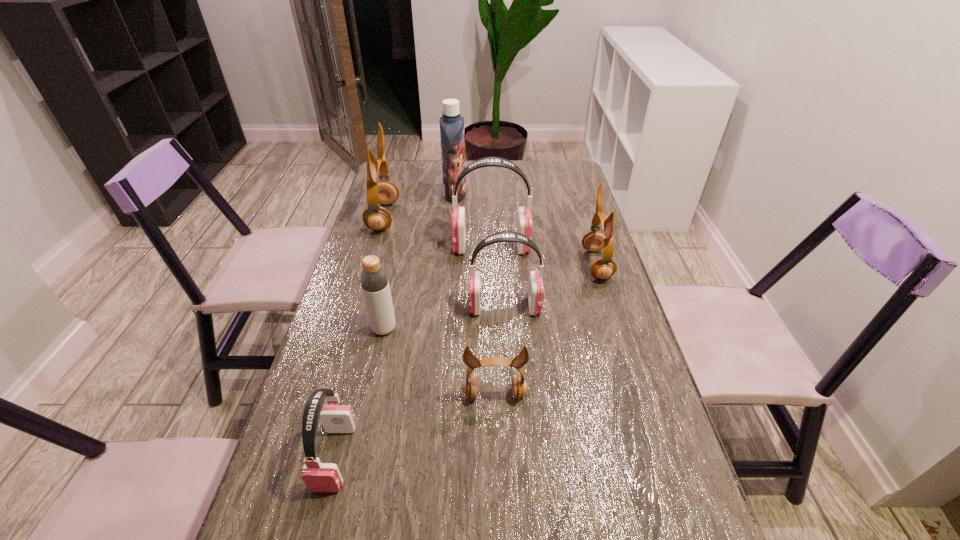
Where is `vacant space at the far edge`? The image size is (960, 540). vacant space at the far edge is located at coordinates (441, 178).

Identify the location of vacant area at the left edge. (351, 349).

In the image, there is a desktop. At what (x,y) coordinates should I click in order to perform the action: click on blank space at the right edge. Please return your answer as a coordinate pair (x, y). This screenshot has width=960, height=540. Looking at the image, I should click on (598, 379).

The width and height of the screenshot is (960, 540). In order to click on free region at the far right corner of the desktop in this screenshot , I will do `click(542, 164)`.

At what (x,y) coordinates should I click in order to perform the action: click on unoccupied area between the leftmost brown earphone and the nearest earphone. Please return your answer as a coordinate pair (x, y). Looking at the image, I should click on (x=359, y=337).

Find the location of a particular element. free space between the farthest pink earphone and the biggest brown earphone is located at coordinates (438, 232).

The height and width of the screenshot is (540, 960). What are the coordinates of `empty location between the second nearest object and the second farthest brown earphone` in the screenshot? It's located at (x=545, y=330).

At what (x,y) coordinates should I click in order to perform the action: click on empty space that is in between the second smallest pink earphone and the biggest brown earphone. Please return your answer as a coordinate pair (x, y). This screenshot has height=540, width=960. Looking at the image, I should click on (444, 262).

Identify the location of vacant space in between the third nearest object and the nearest object. The image size is (960, 540). (359, 393).

This screenshot has width=960, height=540. What are the coordinates of `blank region between the nearest pink earphone and the gray bottle` in the screenshot? It's located at [359, 393].